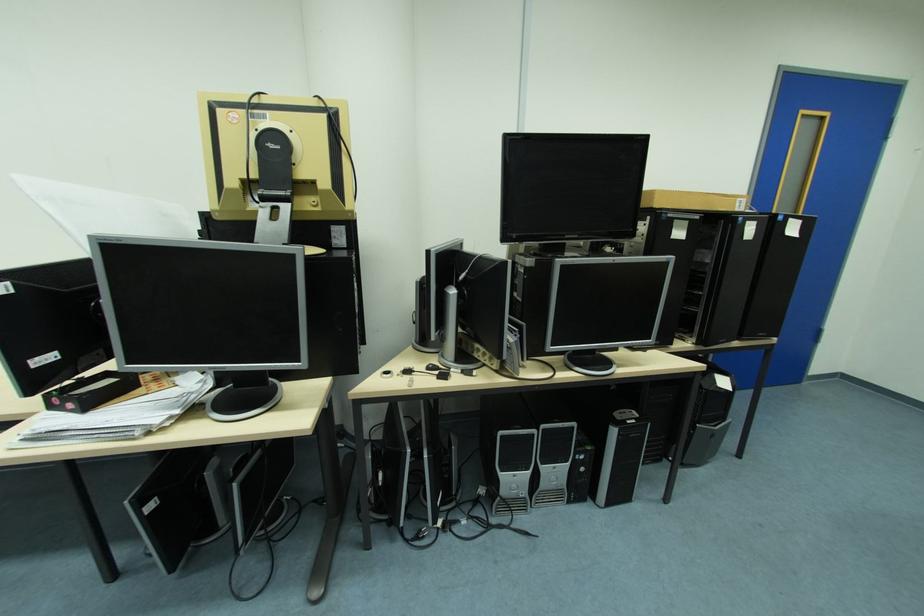
This screenshot has height=616, width=924. I want to click on beige machine knob, so click(306, 208).